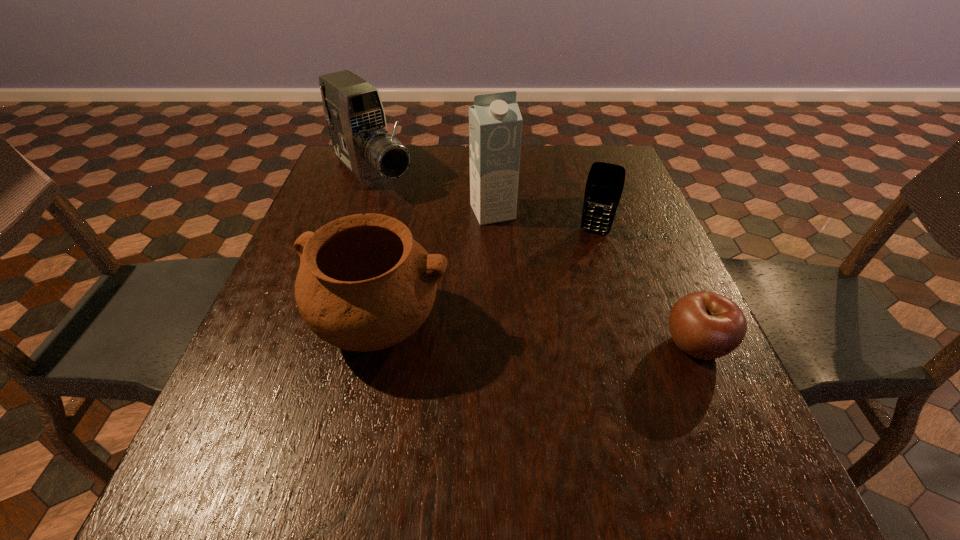
Where is `free space located at the front of the second tallest object, highlighting the lens`? free space located at the front of the second tallest object, highlighting the lens is located at coordinates (443, 247).

Where is `free spot located 0.250m on the screen of the second object from right to left`? The image size is (960, 540). free spot located 0.250m on the screen of the second object from right to left is located at coordinates (569, 310).

Locate an element on the screen. This screenshot has height=540, width=960. blank area located 0.340m on the screen of the second object from right to left is located at coordinates (560, 343).

Locate an element on the screen. The image size is (960, 540). free space located on the screen of the second object from right to left is located at coordinates (583, 265).

The image size is (960, 540). Find the location of `free space located on the front label of the carton`. free space located on the front label of the carton is located at coordinates (527, 278).

Locate an element on the screen. This screenshot has height=540, width=960. vacant region located 0.160m on the front label of the carton is located at coordinates (520, 266).

At what (x,y) coordinates should I click in order to perform the action: click on free spot located 0.160m on the front label of the carton. Please return your answer as a coordinate pair (x, y). Looking at the image, I should click on click(520, 266).

The width and height of the screenshot is (960, 540). Identify the location of object present at the far edge. (353, 109).

The image size is (960, 540). What are the coordinates of `pottery at the left edge` in the screenshot? It's located at (364, 284).

Locate an element on the screen. The image size is (960, 540). camcorder that is at the left edge is located at coordinates (353, 109).